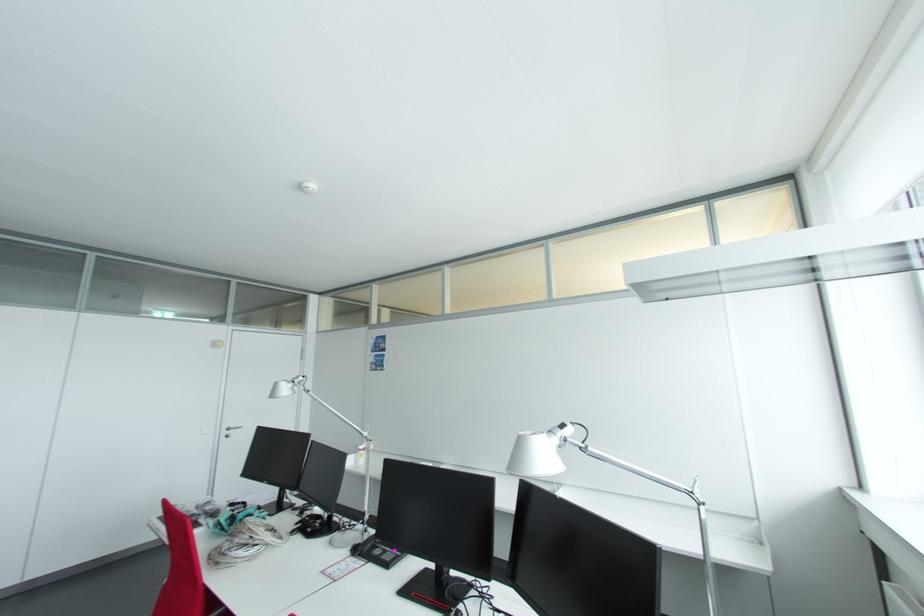
Where is `silver door handle`? This screenshot has width=924, height=616. silver door handle is located at coordinates (229, 430).